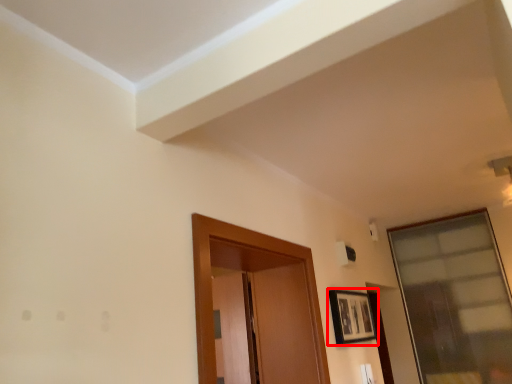
Question: Observing the image, what is the correct spatial positioning of picture frame (annotated by the red box) in reference to window?

Choices:
 (A) left
 (B) right

Answer: (A)